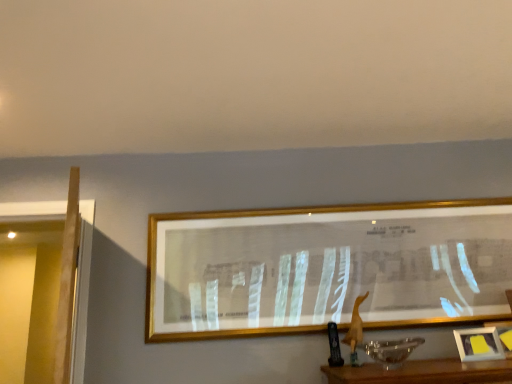
Measure the distance between point (459,343) and camera.

Point (459,343) and camera are 1.99 meters apart.

You are a GUI agent. You are given a task and a screenshot of the screen. Output one action in this format:
    pyautogui.click(x=<x>, y=<y>)
    Task: Click on the yellow paper at lower right, the 1th picture frame from the right
    The height and width of the screenshot is (384, 512).
    Given the screenshot: What is the action you would take?
    pyautogui.click(x=479, y=344)

The height and width of the screenshot is (384, 512). What do you see at coordinates (479, 344) in the screenshot? I see `yellow paper at lower right, the first picture frame positioned from the front` at bounding box center [479, 344].

Find the location of a particular element. gold-framed picture at center, which is counted as the first picture frame, starting from the back is located at coordinates (326, 267).

This screenshot has width=512, height=384. What do you see at coordinates (326, 267) in the screenshot? I see `gold-framed picture at center, which is counted as the first picture frame, starting from the back` at bounding box center [326, 267].

Image resolution: width=512 pixels, height=384 pixels. What are the coordinates of `yellow paper at lower right, the first picture frame positioned from the front` in the screenshot? It's located at (479, 344).

Does yellow paper at lower right, the 1th picture frame from the right, appear on the left side of gold-framed picture at center, acting as the 2th picture frame starting from the right?

Incorrect, yellow paper at lower right, the 1th picture frame from the right, is not on the left side of gold-framed picture at center, acting as the 2th picture frame starting from the right.

Between yellow paper at lower right, the 1th picture frame from the right, and gold-framed picture at center, which is counted as the 1th picture frame, starting from the left, which one is positioned behind?

gold-framed picture at center, which is counted as the 1th picture frame, starting from the left.

Which point is more distant from viewer, (480, 344) or (381, 241)?

The point (381, 241) is farther from the camera.

From the image's perspective, which is above, yellow paper at lower right, the 1th picture frame from the right, or gold-framed picture at center, which is counted as the first picture frame, starting from the back?

gold-framed picture at center, which is counted as the first picture frame, starting from the back.

From a real-world perspective, does yellow paper at lower right, the 2th picture frame in the left-to-right sequence, sit lower than gold-framed picture at center, which is counted as the 1th picture frame, starting from the left?

Yes.

Does yellow paper at lower right, the 2th picture frame in the left-to-right sequence, have a greater width compared to gold-framed picture at center, which is counted as the first picture frame, starting from the back?

Incorrect, the width of yellow paper at lower right, the 2th picture frame in the left-to-right sequence, does not surpass that of gold-framed picture at center, which is counted as the first picture frame, starting from the back.

From their relative heights in the image, would you say yellow paper at lower right, the first picture frame positioned from the front, is taller or shorter than gold-framed picture at center, acting as the 2th picture frame starting from the right?

Considering their sizes, yellow paper at lower right, the first picture frame positioned from the front, has less height than gold-framed picture at center, acting as the 2th picture frame starting from the right.

Between yellow paper at lower right, the 2th picture frame in the left-to-right sequence, and gold-framed picture at center, which ranks as the 2th picture frame in front-to-back order, which one has larger size?

Bigger between the two is gold-framed picture at center, which ranks as the 2th picture frame in front-to-back order.

Is yellow paper at lower right, which ranks as the second picture frame in back-to-front order, situated inside gold-framed picture at center, which is counted as the first picture frame, starting from the back, or outside?

yellow paper at lower right, which ranks as the second picture frame in back-to-front order, cannot be found inside gold-framed picture at center, which is counted as the first picture frame, starting from the back.

Is yellow paper at lower right, which ranks as the second picture frame in back-to-front order, touching gold-framed picture at center, acting as the 2th picture frame starting from the right?

They are not placed beside each other.

Is yellow paper at lower right, the 2th picture frame in the left-to-right sequence, oriented away from gold-framed picture at center, which is counted as the 1th picture frame, starting from the left?

No, gold-framed picture at center, which is counted as the 1th picture frame, starting from the left, is not at the back of yellow paper at lower right, the 2th picture frame in the left-to-right sequence.

How much distance is there between yellow paper at lower right, the 2th picture frame in the left-to-right sequence, and gold-framed picture at center, which is counted as the 1th picture frame, starting from the left?

yellow paper at lower right, the 2th picture frame in the left-to-right sequence, and gold-framed picture at center, which is counted as the 1th picture frame, starting from the left, are 68.24 centimeters apart.

What are the coordinates of `picture frame on the left of yellow paper at lower right, the 2th picture frame in the left-to-right sequence` in the screenshot? It's located at (x=326, y=267).

Can you confirm if gold-framed picture at center, which is counted as the 1th picture frame, starting from the left, is positioned to the right of yellow paper at lower right, which ranks as the second picture frame in back-to-front order?

No, gold-framed picture at center, which is counted as the 1th picture frame, starting from the left, is not to the right of yellow paper at lower right, which ranks as the second picture frame in back-to-front order.

Is gold-framed picture at center, which is counted as the first picture frame, starting from the back, positioned before yellow paper at lower right, which ranks as the second picture frame in back-to-front order?

No, the depth of gold-framed picture at center, which is counted as the first picture frame, starting from the back, is greater than that of yellow paper at lower right, which ranks as the second picture frame in back-to-front order.

Considering the positions of points (223, 287) and (474, 329), is point (223, 287) closer to camera compared to point (474, 329)?

No, (223, 287) is further to viewer.

From the image's perspective, who appears lower, gold-framed picture at center, acting as the 2th picture frame starting from the right, or yellow paper at lower right, the 2th picture frame in the left-to-right sequence?

yellow paper at lower right, the 2th picture frame in the left-to-right sequence, is shown below in the image.

From a real-world perspective, which is physically below, gold-framed picture at center, which is counted as the first picture frame, starting from the back, or yellow paper at lower right, which ranks as the second picture frame in back-to-front order?

In real-world perspective, yellow paper at lower right, which ranks as the second picture frame in back-to-front order, is lower.

Which object is thinner, gold-framed picture at center, which is counted as the 1th picture frame, starting from the left, or yellow paper at lower right, the 1th picture frame from the right?

yellow paper at lower right, the 1th picture frame from the right, is thinner.

Can you confirm if gold-framed picture at center, which is counted as the 1th picture frame, starting from the left, is shorter than yellow paper at lower right, the 1th picture frame from the right?

No, gold-framed picture at center, which is counted as the 1th picture frame, starting from the left, is not shorter than yellow paper at lower right, the 1th picture frame from the right.

Does gold-framed picture at center, acting as the 2th picture frame starting from the right, have a smaller size compared to yellow paper at lower right, the 2th picture frame in the left-to-right sequence?

Actually, gold-framed picture at center, acting as the 2th picture frame starting from the right, might be larger than yellow paper at lower right, the 2th picture frame in the left-to-right sequence.

Is gold-framed picture at center, which is counted as the 1th picture frame, starting from the left, completely or partially outside of yellow paper at lower right, the 1th picture frame from the right?

Yes, gold-framed picture at center, which is counted as the 1th picture frame, starting from the left, is not within yellow paper at lower right, the 1th picture frame from the right.

Is gold-framed picture at center, which is counted as the 1th picture frame, starting from the left, not near yellow paper at lower right, the 1th picture frame from the right?

gold-framed picture at center, which is counted as the 1th picture frame, starting from the left, is near yellow paper at lower right, the 1th picture frame from the right, not far away.

Could you tell me if gold-framed picture at center, which is counted as the first picture frame, starting from the back, is turned towards yellow paper at lower right, which ranks as the second picture frame in back-to-front order?

No, gold-framed picture at center, which is counted as the first picture frame, starting from the back, is not facing towards yellow paper at lower right, which ranks as the second picture frame in back-to-front order.

How many degrees apart are the facing directions of gold-framed picture at center, acting as the 2th picture frame starting from the right, and yellow paper at lower right, the 2th picture frame in the left-to-right sequence?

10.6 degrees.

Locate an element on the screen. Image resolution: width=512 pixels, height=384 pixels. picture frame above the yellow paper at lower right, the 1th picture frame from the right (from the image's perspective) is located at coordinates (326, 267).

Where is `picture frame above the yellow paper at lower right, the first picture frame positioned from the front (from the image's perspective)`? The height and width of the screenshot is (384, 512). picture frame above the yellow paper at lower right, the first picture frame positioned from the front (from the image's perspective) is located at coordinates pyautogui.click(x=326, y=267).

The height and width of the screenshot is (384, 512). Find the location of `picture frame located behind the yellow paper at lower right, which ranks as the second picture frame in back-to-front order`. picture frame located behind the yellow paper at lower right, which ranks as the second picture frame in back-to-front order is located at coordinates (326, 267).